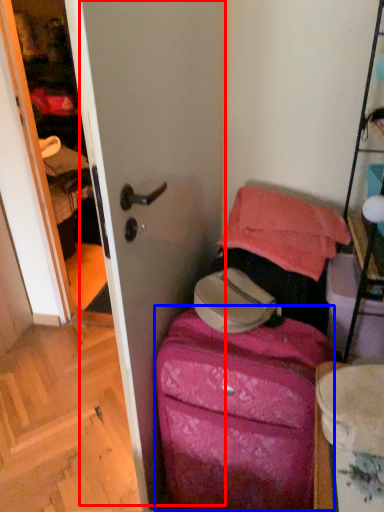
Question: Among these objects, which one is nearest to the camera, screen door (highlighted by a red box) or luggage (highlighted by a blue box)?

Choices:
 (A) screen door
 (B) luggage

Answer: (A)